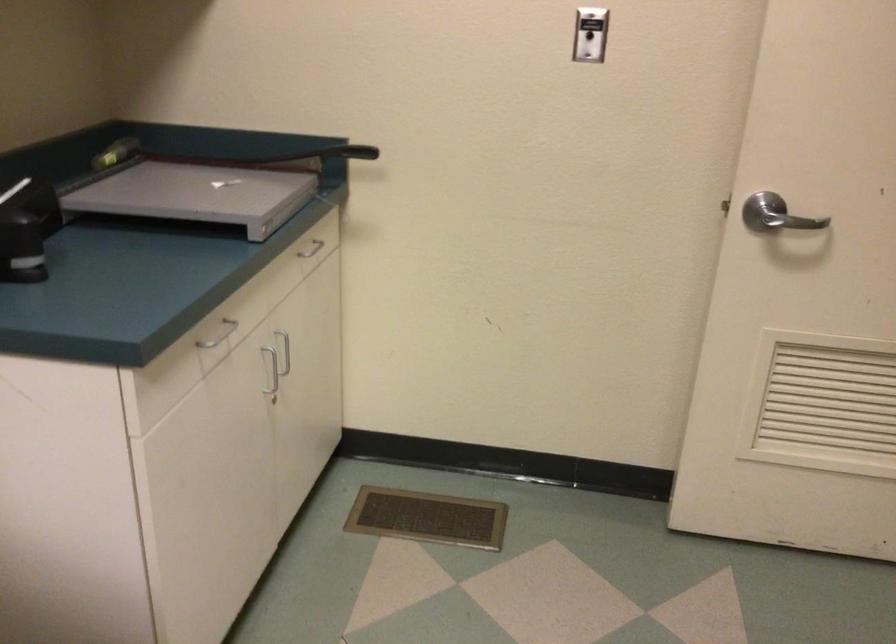
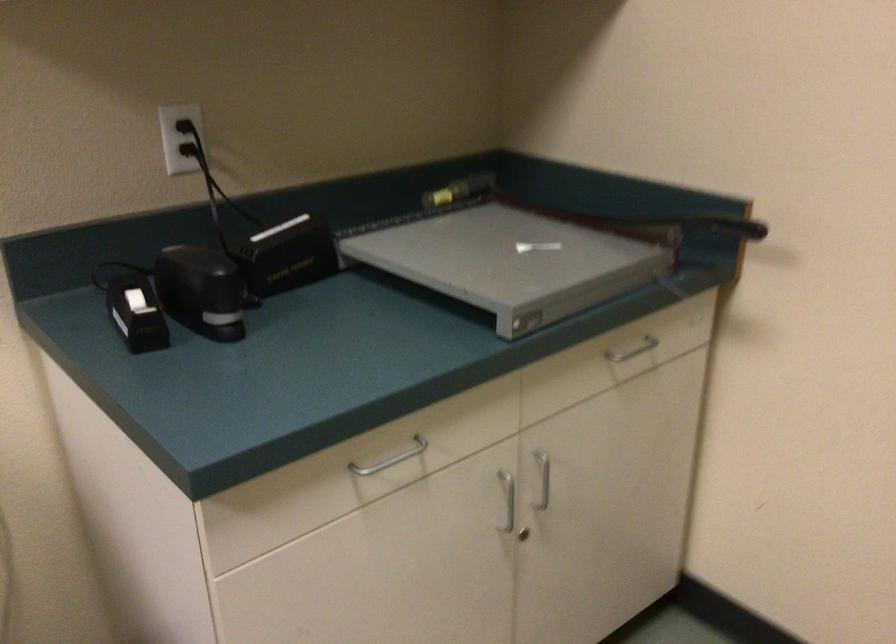
The point at (312,247) is marked in the first image. Where is the corresponding point in the second image?

(633, 348)